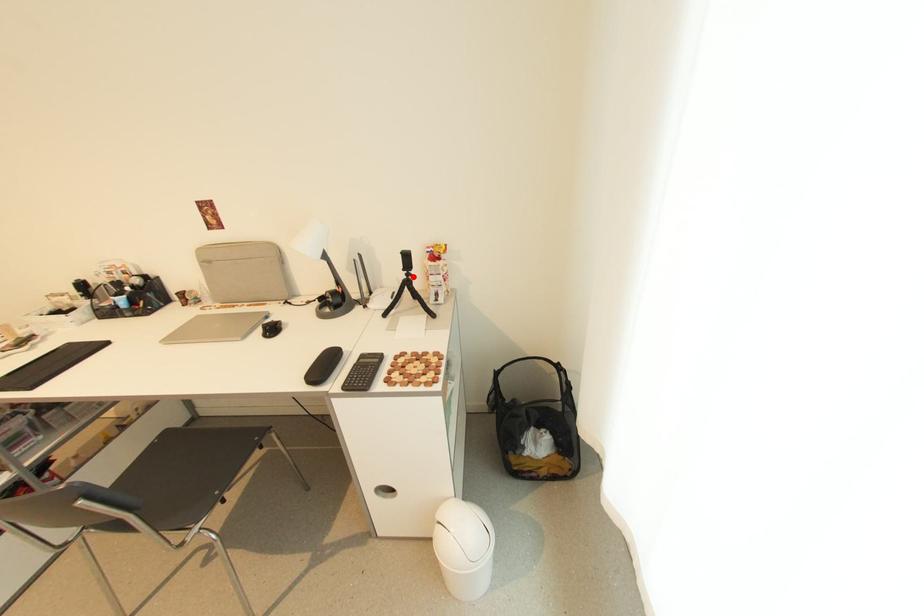
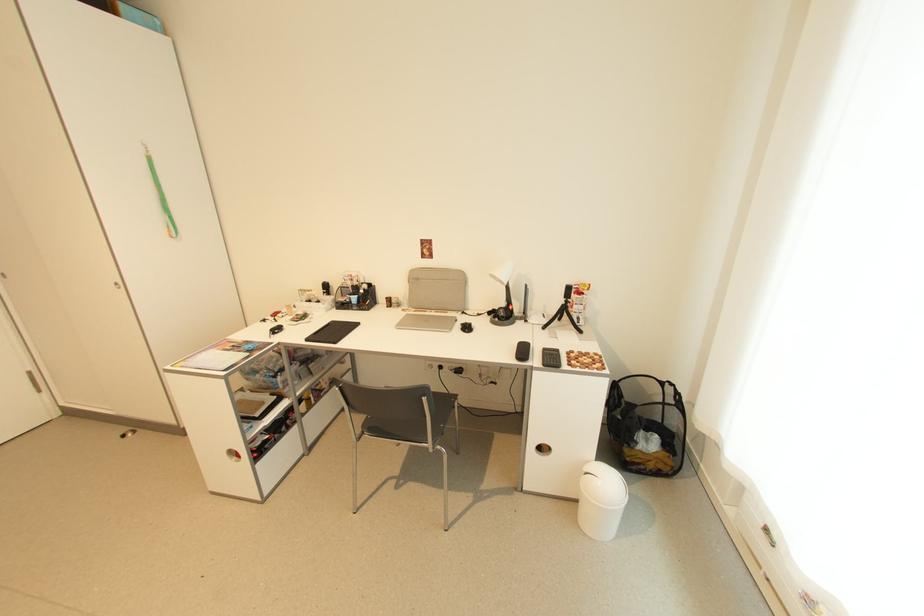
The point at the highlighted location is marked in the first image. Where is the corresponding point in the second image?

(572, 302)